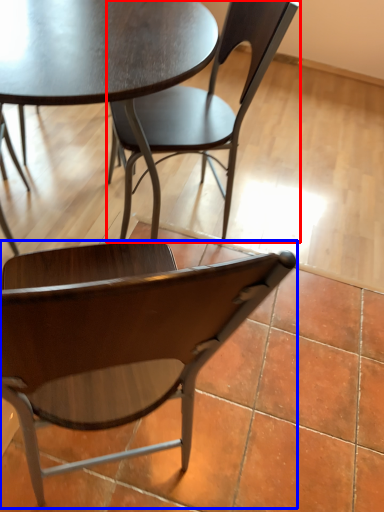
Question: Which object is closer to the camera taking this photo, chair (highlighted by a red box) or chair (highlighted by a blue box)?

Choices:
 (A) chair
 (B) chair

Answer: (B)